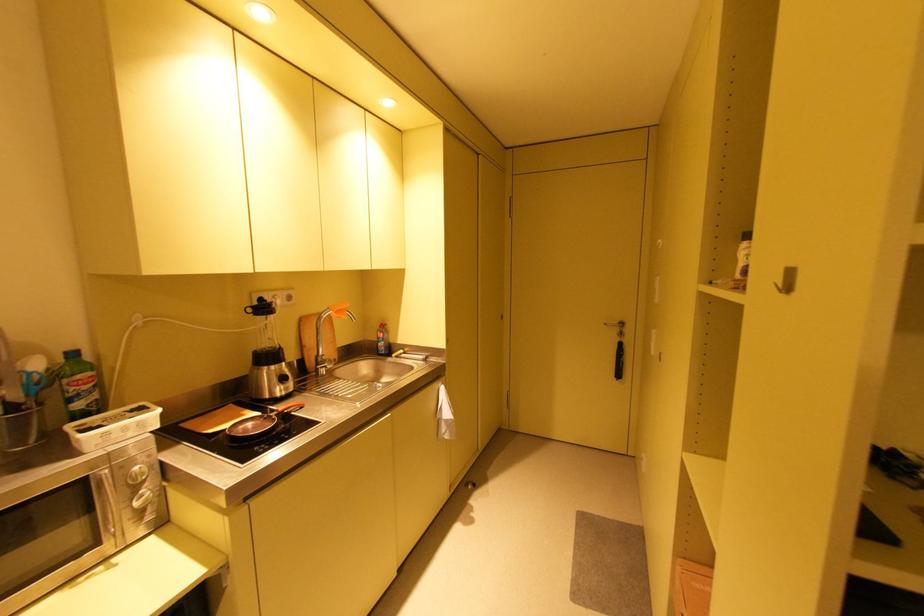
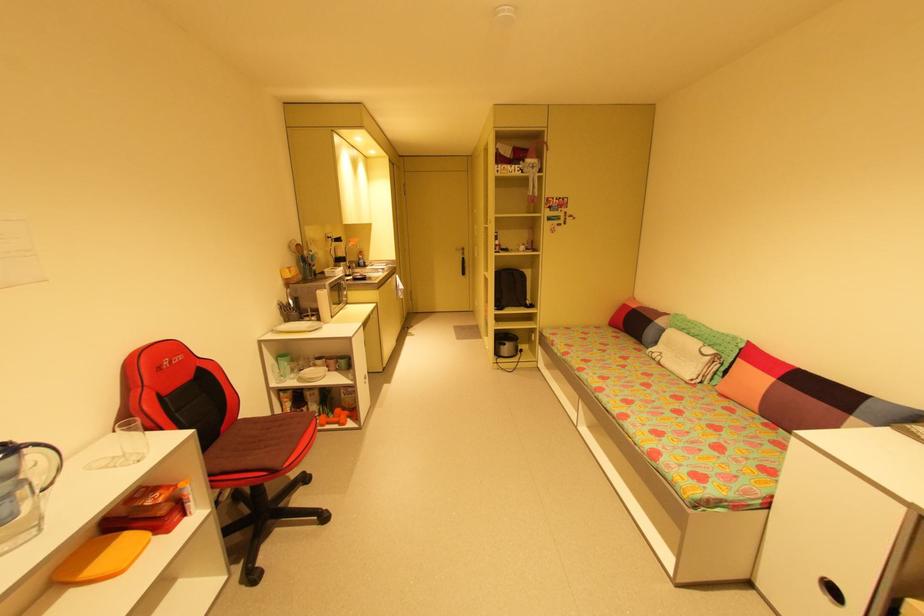
Find the pixel in the second image that matches [610,323] in the first image.

(460, 249)